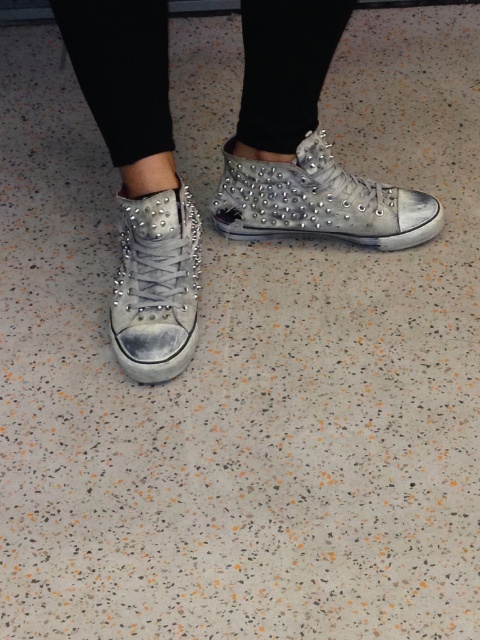
Who is shorter, distressed white sneakers at center or silver studded sneaker at center?

Standing shorter between the two is silver studded sneaker at center.

Is point (159, 134) positioned behind point (360, 196)?

No.

Does point (176, 216) lie in front of point (236, 227)?

Yes, point (176, 216) is closer to viewer.

Image resolution: width=480 pixels, height=640 pixels. I want to click on distressed white sneakers at center, so click(140, 179).

Does point (135, 256) lie behind point (179, 340)?

Yes, point (135, 256) is farther from viewer.

Locate an element on the screen. The width and height of the screenshot is (480, 640). distressed white sneakers at center is located at coordinates (140, 179).

Does point (301, 193) come behind point (134, 259)?

Yes, it is.

Does silver studded sneaker at center have a lesser width compared to distressed white leather sneaker at center?

No, silver studded sneaker at center is not thinner than distressed white leather sneaker at center.

Does point (294, 221) come closer to viewer compared to point (163, 278)?

No, it is behind (163, 278).

Where is `silver studded sneaker at center`? The image size is (480, 640). silver studded sneaker at center is located at coordinates (317, 202).